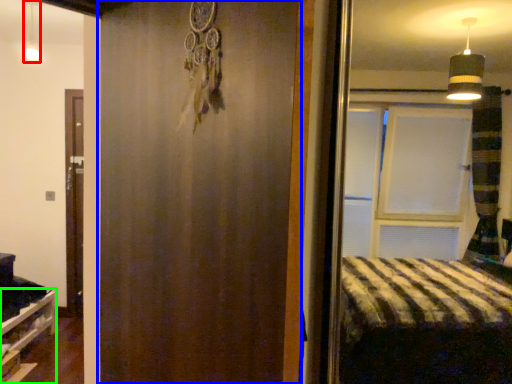
Question: Estimate the real-world distances between objects in this image. Which object is closer to light fixture (highlighted by a red box), barn door (highlighted by a blue box) or shelf (highlighted by a green box)?

Choices:
 (A) barn door
 (B) shelf

Answer: (B)